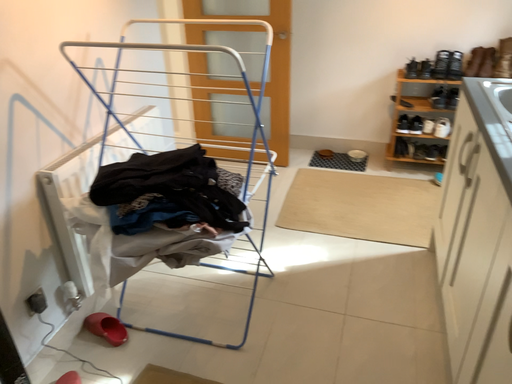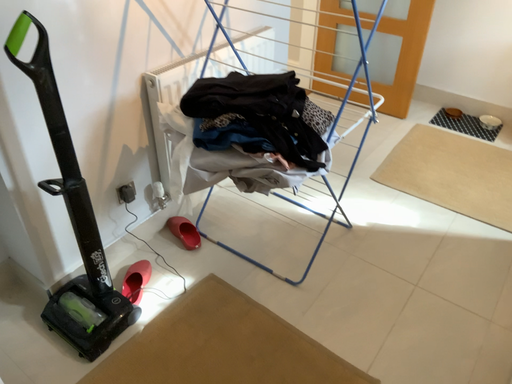
Question: How did the camera likely rotate when shooting the video?

Choices:
 (A) rotated left
 (B) rotated right

Answer: (A)